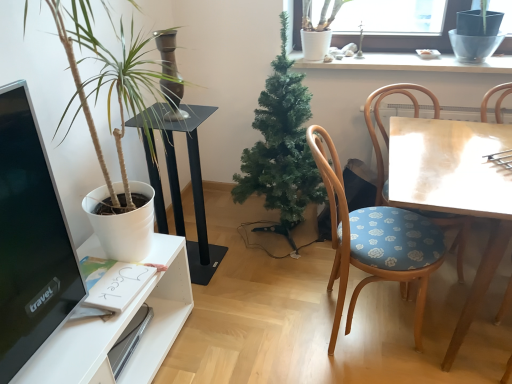
Where is `blank space situated above white ceramic vase at upper center (from a real-world perspective)`? The height and width of the screenshot is (384, 512). blank space situated above white ceramic vase at upper center (from a real-world perspective) is located at coordinates pyautogui.click(x=409, y=60).